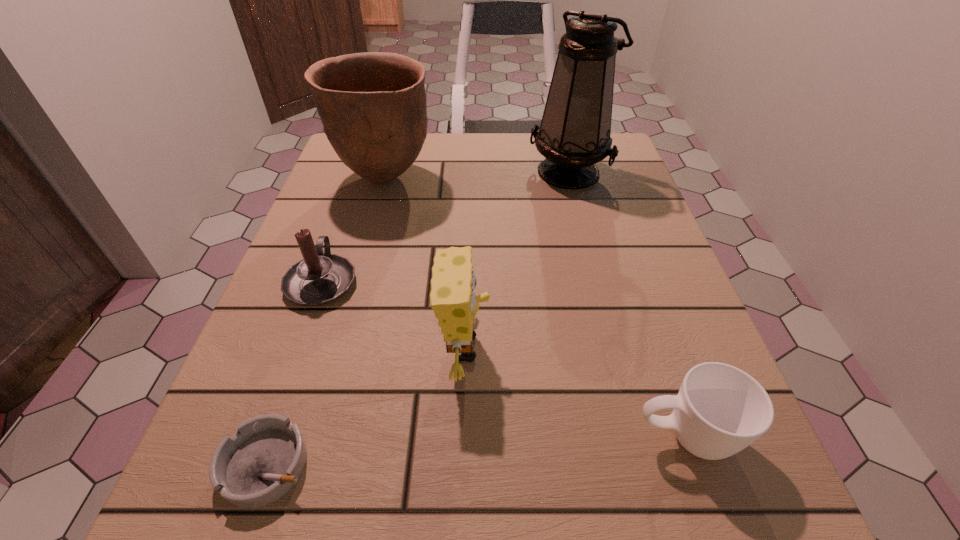
In the image, there is a desktop. Identify the location of vacant space at the right edge. The width and height of the screenshot is (960, 540). (679, 361).

In the image, there is a desktop. Identify the location of vacant region at the far left corner. click(342, 163).

Find the location of a particular element. free space at the far right corner is located at coordinates (618, 144).

What are the coordinates of `vacant point at the near right corner` in the screenshot? It's located at (778, 533).

Where is `free space between the pottery and the cup`? free space between the pottery and the cup is located at coordinates [x=535, y=307].

Image resolution: width=960 pixels, height=540 pixels. Find the location of `free space between the candle and the oil lamp`. free space between the candle and the oil lamp is located at coordinates (445, 226).

I want to click on empty space between the pottery and the third shortest object, so click(353, 230).

Identify the location of free space between the candle and the fifth shortest object. (353, 230).

Locate an element on the screen. free space between the shortest object and the tallest object is located at coordinates (418, 318).

Identify the location of vacant space that is in between the pottery and the tallest object. The height and width of the screenshot is (540, 960). (476, 174).